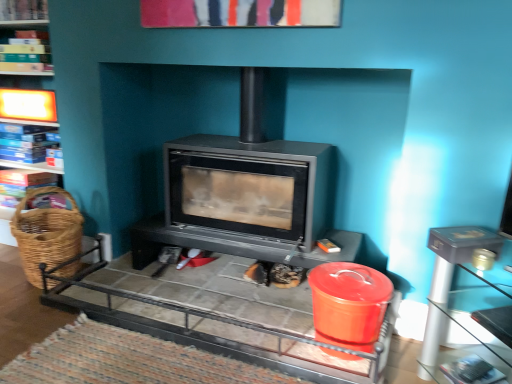
Question: Does wooden bookshelf at upper left, which ranks as the 2th shelf in top-to-bottom order, touch wooden bookshelf at upper left, which is the third shelf in bottom-to-top order?

Choices:
 (A) no
 (B) yes

Answer: (A)

Question: Does wooden bookshelf at upper left, which ranks as the 2th shelf in top-to-bottom order, lie behind wooden bookshelf at upper left, the 1th shelf positioned from the top?

Choices:
 (A) no
 (B) yes

Answer: (B)

Question: Is wooden bookshelf at upper left, which ranks as the 2th shelf in top-to-bottom order, thinner than wooden bookshelf at upper left, which is the third shelf in bottom-to-top order?

Choices:
 (A) yes
 (B) no

Answer: (B)

Question: Does wooden bookshelf at upper left, which is the second shelf in bottom-to-top order, have a smaller size compared to wooden bookshelf at upper left, which is the third shelf in bottom-to-top order?

Choices:
 (A) no
 (B) yes

Answer: (A)

Question: From their relative heights in the image, would you say wooden bookshelf at upper left, which is the second shelf in bottom-to-top order, is taller or shorter than woven brown basket at left?

Choices:
 (A) tall
 (B) short

Answer: (B)

Question: Is point (0, 44) closer or farther from the camera than point (39, 226)?

Choices:
 (A) farther
 (B) closer

Answer: (A)

Question: From a real-world perspective, is wooden bookshelf at upper left, which ranks as the 2th shelf in top-to-bottom order, positioned above or below woven brown basket at left?

Choices:
 (A) above
 (B) below

Answer: (A)

Question: Is wooden bookshelf at upper left, which ranks as the 2th shelf in top-to-bottom order, bigger or smaller than woven brown basket at left?

Choices:
 (A) small
 (B) big

Answer: (A)

Question: Looking at their shapes, would you say woven brown basket at left is wider or thinner than wooden bookshelf at upper left, which is the second shelf in bottom-to-top order?

Choices:
 (A) thin
 (B) wide

Answer: (B)

Question: Is woven brown basket at left spatially inside wooden bookshelf at upper left, which is the second shelf in bottom-to-top order, or outside of it?

Choices:
 (A) inside
 (B) outside

Answer: (B)

Question: Is woven brown basket at left taller or shorter than wooden bookshelf at upper left, which ranks as the 2th shelf in top-to-bottom order?

Choices:
 (A) short
 (B) tall

Answer: (B)

Question: Is point (56, 188) closer or farther from the camera than point (18, 33)?

Choices:
 (A) farther
 (B) closer

Answer: (B)

Question: Looking at their shapes, would you say metallic gray table at right, arranged as the second table when viewed from the left, is wider or thinner than blue cardboard boxes at left, which is the third shelf from top to bottom?

Choices:
 (A) wide
 (B) thin

Answer: (A)

Question: In the image, is metallic gray table at right, acting as the 1th table starting from the right, positioned in front of or behind blue cardboard boxes at left, which is the third shelf from top to bottom?

Choices:
 (A) behind
 (B) front

Answer: (B)